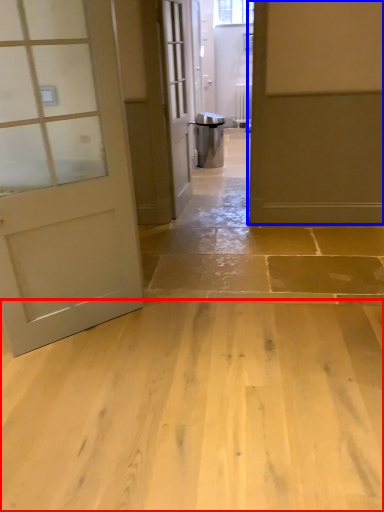
Question: Which object is further to the camera taking this photo, concrete (highlighted by a red box) or door (highlighted by a blue box)?

Choices:
 (A) concrete
 (B) door

Answer: (B)